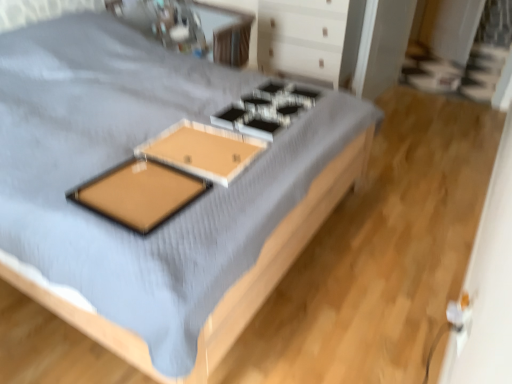
This screenshot has height=384, width=512. Identify the location of white glossy drawer at upper center. (301, 39).

The width and height of the screenshot is (512, 384). I want to click on wooden tray at center, the first table in the front-to-back sequence, so click(x=203, y=150).

The width and height of the screenshot is (512, 384). What are the coordinates of `metallic silver gas stove at center` in the screenshot? It's located at (266, 109).

From the image's perspective, is wooden bed at center located above or below white glossy drawer at upper center?

Clearly, from the image's perspective, wooden bed at center is below white glossy drawer at upper center.

Locate an element on the screen. bed that is in front of the white glossy drawer at upper center is located at coordinates (173, 218).

Does wooden bed at center have a lesser width compared to white glossy drawer at upper center?

In fact, wooden bed at center might be wider than white glossy drawer at upper center.

Would you say wooden bed at center is inside or outside white glossy drawer at upper center?

The correct answer is: outside.

Is wooden tray at upper center, the 1th table positioned from the back, aimed at white glossy drawer at upper center?

No, wooden tray at upper center, the 1th table positioned from the back, does not turn towards white glossy drawer at upper center.

From a real-world perspective, which is physically below, wooden tray at upper center, positioned as the second table in bottom-to-top order, or white glossy drawer at upper center?

white glossy drawer at upper center, from a real-world perspective.

From the image's perspective, is wooden tray at upper center, the second table when ordered from front to back, above white glossy drawer at upper center?

No, from the image's perspective, wooden tray at upper center, the second table when ordered from front to back, is not above white glossy drawer at upper center.

Between wooden tray at upper center, the 1th table positioned from the back, and white glossy drawer at upper center, which one is positioned behind?

white glossy drawer at upper center is behind.

Between white glossy drawer at upper center and wooden bed at center, which one has smaller size?

wooden bed at center is smaller.

In the scene shown: Considering the positions of objects white glossy drawer at upper center and wooden bed at center in the image provided, who is in front, white glossy drawer at upper center or wooden bed at center?

Positioned in front is wooden bed at center.

Choose the correct answer: Is white glossy drawer at upper center inside wooden bed at center or outside it?

white glossy drawer at upper center exists outside the volume of wooden bed at center.

Considering the positions of points (272, 30) and (44, 259), is point (272, 30) closer to camera compared to point (44, 259)?

That is False.

In the scene shown: In the image, is brown matte board at center on the left side or the right side of metallic silver gas stove at center?

brown matte board at center is positioned on metallic silver gas stove at center's left side.

Find the location of `pad in front of the metallic silver gas stove at center`. pad in front of the metallic silver gas stove at center is located at coordinates (140, 193).

Is brown matte board at center situated inside metallic silver gas stove at center or outside?

brown matte board at center is spatially situated outside metallic silver gas stove at center.

Considering the sizes of wooden tray at upper center, positioned as the second table in bottom-to-top order, and wooden bed at center in the image, is wooden tray at upper center, positioned as the second table in bottom-to-top order, taller or shorter than wooden bed at center?

Clearly, wooden tray at upper center, positioned as the second table in bottom-to-top order, is taller compared to wooden bed at center.

Which object is thinner, wooden tray at upper center, placed as the 1th table when sorted from top to bottom, or wooden bed at center?

wooden tray at upper center, placed as the 1th table when sorted from top to bottom, is thinner.

From a real-world perspective, is wooden tray at upper center, positioned as the second table in bottom-to-top order, positioned over wooden bed at center based on gravity?

Yes, from a real-world perspective, wooden tray at upper center, positioned as the second table in bottom-to-top order, is on top of wooden bed at center.

Is wooden tray at upper center, the second table when ordered from front to back, aimed at wooden bed at center?

Yes, wooden tray at upper center, the second table when ordered from front to back, faces towards wooden bed at center.

Can you confirm if metallic silver gas stove at center is wider than wooden bed at center?

Incorrect, the width of metallic silver gas stove at center does not surpass that of wooden bed at center.

From the image's perspective, which is above, metallic silver gas stove at center or wooden bed at center?

metallic silver gas stove at center is shown above in the image.

Considering the relative positions of metallic silver gas stove at center and wooden bed at center in the image provided, is metallic silver gas stove at center to the left of wooden bed at center from the viewer's perspective?

Indeed, metallic silver gas stove at center is positioned on the left side of wooden bed at center.

Measure the distance from wooden bed at center to metallic silver gas stove at center.

wooden bed at center and metallic silver gas stove at center are 18.66 inches apart.

What's the angular difference between wooden bed at center and metallic silver gas stove at center's facing directions?

93.1 degrees separate the facing orientations of wooden bed at center and metallic silver gas stove at center.

Considering the sizes of wooden bed at center and metallic silver gas stove at center in the image, is wooden bed at center wider or thinner than metallic silver gas stove at center?

Clearly, wooden bed at center has more width compared to metallic silver gas stove at center.

Is wooden bed at center taller than metallic silver gas stove at center?

Correct, wooden bed at center is much taller as metallic silver gas stove at center.

The width and height of the screenshot is (512, 384). In order to click on drawer above the wooden bed at center (from the image's perspective) in this screenshot , I will do `click(301, 39)`.

You are a GUI agent. You are given a task and a screenshot of the screen. Output one action in this format:
    pyautogui.click(x=<x>, y=<y>)
    Task: Click on the drawer that is behind the wooden tray at upper center, placed as the 1th table when sorted from top to bottom
    The width and height of the screenshot is (512, 384).
    Given the screenshot: What is the action you would take?
    pyautogui.click(x=301, y=39)

Which object lies nearer to the anchor point metallic silver gas stove at center, wooden tray at upper center, the second table when ordered from front to back, or brown matte board at center?

brown matte board at center.

Based on their spatial positions, is wooden tray at center, arranged as the 2th table when viewed from the top, or brown matte board at center closer to metallic silver gas stove at center?

wooden tray at center, arranged as the 2th table when viewed from the top, lies closer to metallic silver gas stove at center than the other object.

Considering their positions, is brown matte board at center positioned further to wooden tray at center, the first table in the front-to-back sequence, than wooden bed at center?

wooden bed at center.

Based on their spatial positions, is wooden tray at upper center, the second table when ordered from front to back, or wooden bed at center closer to metallic silver gas stove at center?

wooden bed at center lies closer to metallic silver gas stove at center than the other object.

Looking at the image, which one is located closer to metallic silver gas stove at center, white glossy drawer at upper center or wooden tray at center, arranged as the 2th table when viewed from the top?

wooden tray at center, arranged as the 2th table when viewed from the top, is positioned closer to the anchor metallic silver gas stove at center.

Looking at the image, which one is located further to wooden tray at center, which is the 1th table in bottom-to-top order, brown matte board at center or wooden tray at upper center, the second table when ordered from front to back?

wooden tray at upper center, the second table when ordered from front to back, lies further to wooden tray at center, which is the 1th table in bottom-to-top order, than the other object.

Which object lies further to the anchor point brown matte board at center, wooden tray at upper center, positioned as the second table in bottom-to-top order, or wooden tray at center, which is the 1th table in bottom-to-top order?

Among the two, wooden tray at upper center, positioned as the second table in bottom-to-top order, is located further to brown matte board at center.

From the image, which object appears to be nearer to white glossy drawer at upper center, brown matte board at center or wooden bed at center?

wooden bed at center lies closer to white glossy drawer at upper center than the other object.

You are a GUI agent. You are given a task and a screenshot of the screen. Output one action in this format:
    pyautogui.click(x=<x>, y=<y>)
    Task: Click on the table between brown matte board at center and metallic silver gas stove at center from front to back
    This screenshot has height=384, width=512.
    Given the screenshot: What is the action you would take?
    pyautogui.click(x=203, y=150)

Identify the location of gas stove between wooden tray at center, the first table in the front-to-back sequence, and wooden tray at upper center, the second table when ordered from front to back, from front to back. (266, 109).

In order to click on pad between wooden bed at center and white glossy drawer at upper center from front to back in this screenshot , I will do `click(140, 193)`.

Identify the location of pad between wooden bed at center and metallic silver gas stove at center from front to back. (140, 193).